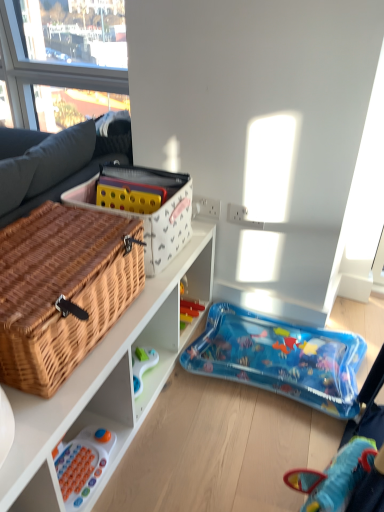
Question: Is white fabric storage box at upper center to the right of white plastic toy at lower left, the 1th toy positioned from the bottom, from the viewer's perspective?

Choices:
 (A) yes
 (B) no

Answer: (A)

Question: From a real-world perspective, is white fabric storage box at upper center below white plastic toy at lower left, which appears as the 2th toy when viewed from the right?

Choices:
 (A) yes
 (B) no

Answer: (B)

Question: From the image's perspective, is white fabric storage box at upper center on top of white plastic toy at lower left, which ranks as the 2th toy in top-to-bottom order?

Choices:
 (A) yes
 (B) no

Answer: (A)

Question: Is white fabric storage box at upper center thinner than white plastic toy at lower left, which ranks as the 2th toy in top-to-bottom order?

Choices:
 (A) yes
 (B) no

Answer: (B)

Question: Considering the relative sizes of white fabric storage box at upper center and white plastic toy at lower left, which appears as the 2th toy when viewed from the right, in the image provided, is white fabric storage box at upper center smaller than white plastic toy at lower left, which appears as the 2th toy when viewed from the right,?

Choices:
 (A) no
 (B) yes

Answer: (A)

Question: From the image's perspective, relative to white plastic toy at lower left, which ranks as the 2th toy in top-to-bottom order, is woven wood cabinet at lower left above or below?

Choices:
 (A) below
 (B) above

Answer: (B)

Question: Is woven wood cabinet at lower left spatially inside white plastic toy at lower left, which appears as the 2th toy when viewed from the right, or outside of it?

Choices:
 (A) inside
 (B) outside

Answer: (B)

Question: Based on their sizes in the image, would you say woven wood cabinet at lower left is bigger or smaller than white plastic toy at lower left, which is the 1th toy from front to back?

Choices:
 (A) big
 (B) small

Answer: (A)

Question: In terms of width, does woven wood cabinet at lower left look wider or thinner when compared to white plastic toy at lower left, which appears as the 2th toy when viewed from the right?

Choices:
 (A) thin
 (B) wide

Answer: (B)

Question: In terms of size, does white plastic toy at lower left, which appears as the 2th toy when viewed from the right, appear bigger or smaller than woven wood cabinet at lower left?

Choices:
 (A) big
 (B) small

Answer: (B)

Question: Considering the positions of point (77, 451) and point (125, 432), is point (77, 451) closer or farther from the camera than point (125, 432)?

Choices:
 (A) farther
 (B) closer

Answer: (B)

Question: In the image, is white plastic toy at lower left, the second toy from the back, positioned in front of or behind woven wood cabinet at lower left?

Choices:
 (A) behind
 (B) front

Answer: (A)

Question: Visually, is white plastic toy at lower left, which is the 1th toy from front to back, positioned to the left or to the right of woven wood cabinet at lower left?

Choices:
 (A) right
 (B) left

Answer: (B)

Question: Considering the positions of woven brown picnic basket at left and white fabric storage box at upper center in the image, is woven brown picnic basket at left bigger or smaller than white fabric storage box at upper center?

Choices:
 (A) big
 (B) small

Answer: (A)

Question: Considering the relative positions of woven brown picnic basket at left and white fabric storage box at upper center in the image provided, is woven brown picnic basket at left to the left or to the right of white fabric storage box at upper center?

Choices:
 (A) left
 (B) right

Answer: (A)